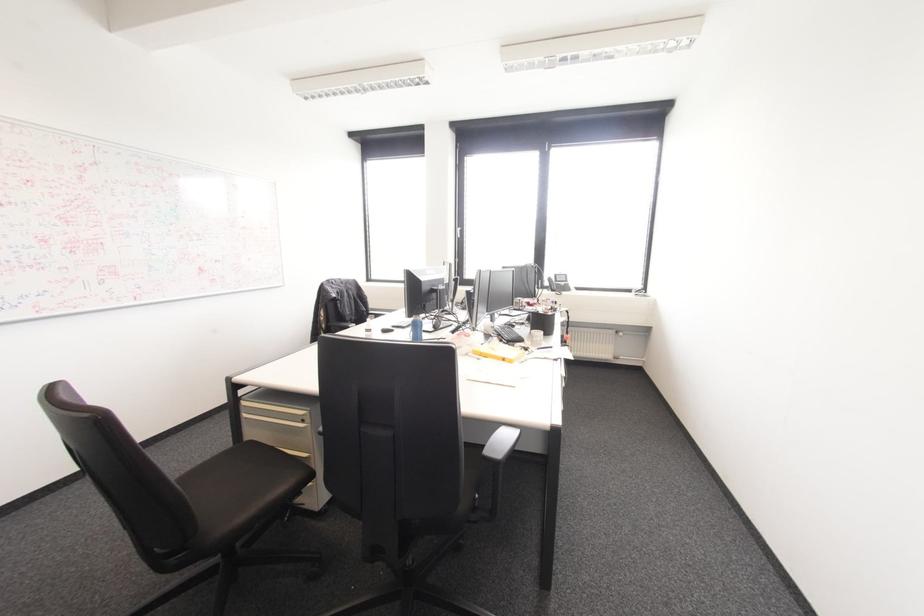
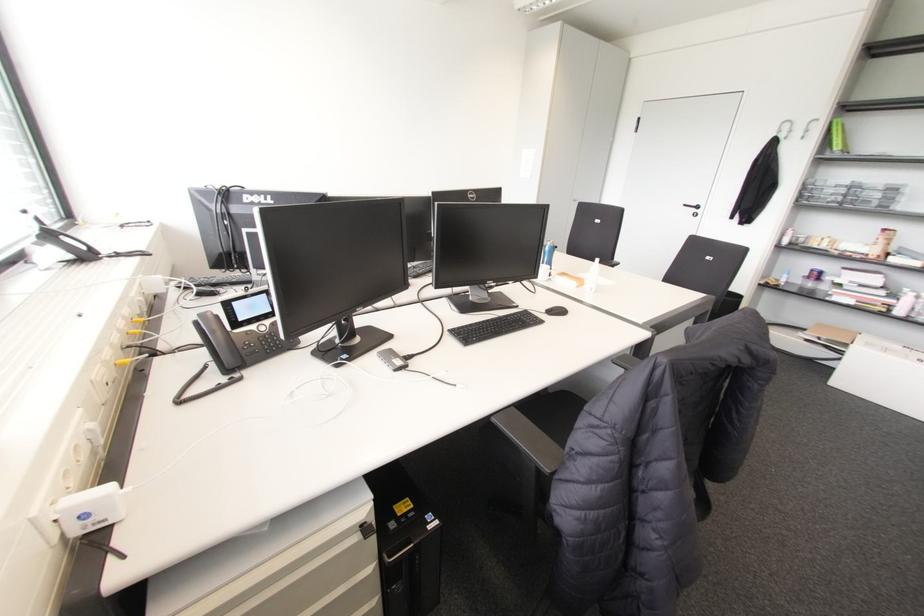
Question: I am providing you with two images of the same scene from different viewpoints. After the viewpoint changes to image2, which objects are now occluded?

Choices:
 (A) white spray bottle
 (B) white machine button
 (C) black computer mouse
 (D) cabinet drawer handle

Answer: (D)